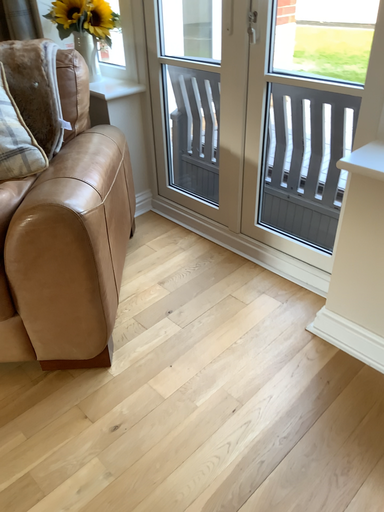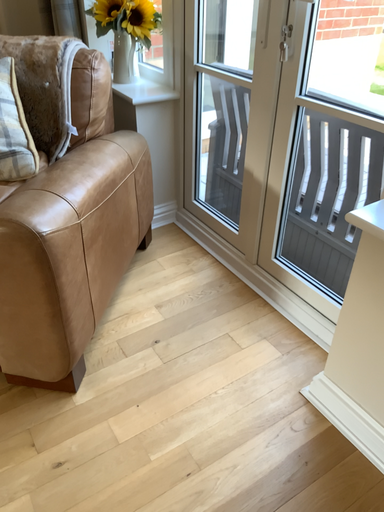
Question: Which way did the camera rotate in the video?

Choices:
 (A) rotated left
 (B) rotated right

Answer: (A)